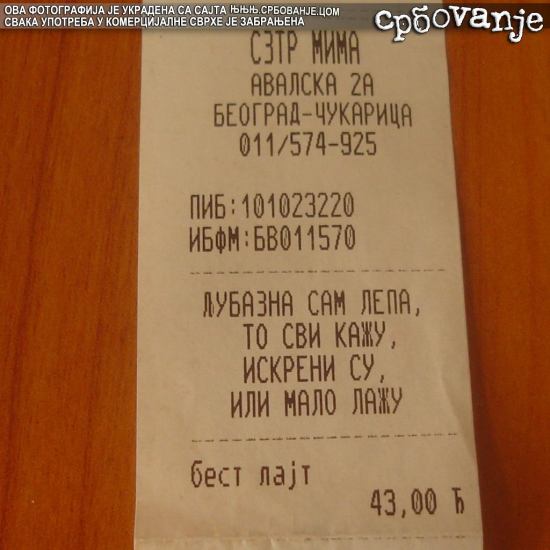
Locate an element on the screen. The width and height of the screenshot is (550, 550). cloth is located at coordinates (67, 336).